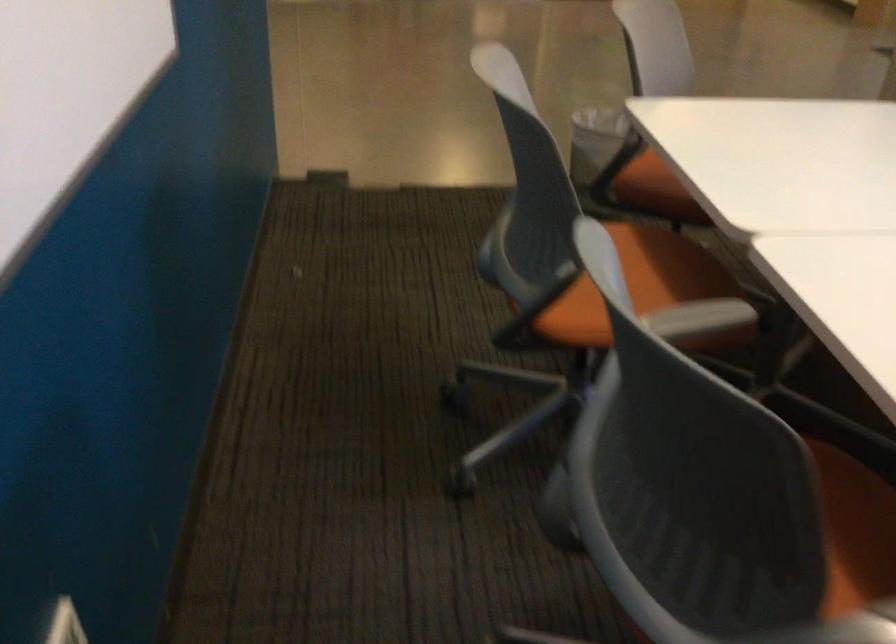
Based on the continuous images, in which direction is the camera rotating?

The camera rotated toward left-down.